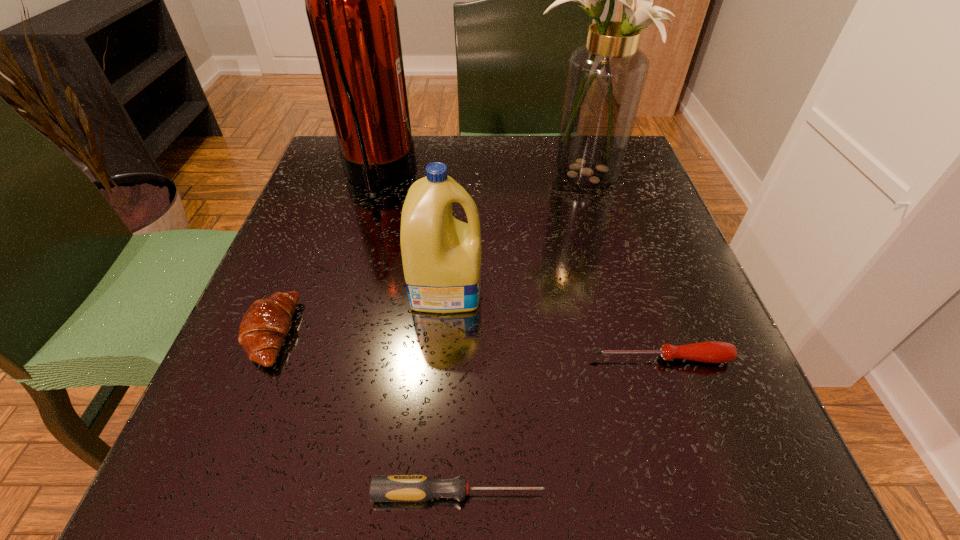
The height and width of the screenshot is (540, 960). Identify the location of object located at the far left corner. (350, 0).

Locate an element on the screen. Image resolution: width=960 pixels, height=540 pixels. object that is at the far right corner is located at coordinates (605, 79).

At what (x,y) coordinates should I click in order to perform the action: click on vacant space at the far edge of the desktop. Please return your answer as a coordinate pair (x, y). The width and height of the screenshot is (960, 540). Looking at the image, I should click on (481, 153).

You are a GUI agent. You are given a task and a screenshot of the screen. Output one action in this format:
    pyautogui.click(x=<x>, y=<y>)
    Task: Click on the vacant point at the near edge
    The image size is (960, 540).
    Given the screenshot: What is the action you would take?
    pyautogui.click(x=533, y=437)

This screenshot has width=960, height=540. In the image, there is a desktop. Identify the location of vacant space at the left edge. (206, 411).

Identify the location of vacant area at the right edge of the desktop. The image size is (960, 540). (593, 251).

The width and height of the screenshot is (960, 540). I want to click on free space at the far left corner of the desktop, so click(x=341, y=192).

Locate an element on the screen. The image size is (960, 540). vacant area at the far right corner is located at coordinates (636, 178).

Image resolution: width=960 pixels, height=540 pixels. In order to click on vacant region at the near right corner of the desktop in this screenshot , I will do `click(649, 471)`.

The image size is (960, 540). I want to click on vacant space in between the tallest object and the flower arrangement, so click(x=480, y=177).